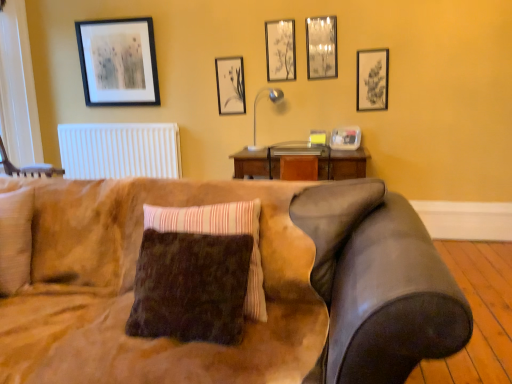
Question: From a real-world perspective, is wooden swivel chair at left located beneath brown fuzzy pillow at center?

Choices:
 (A) no
 (B) yes

Answer: (A)

Question: Is brown fuzzy pillow at center a part of wooden swivel chair at left?

Choices:
 (A) yes
 (B) no

Answer: (B)

Question: Is wooden swivel chair at left at the right side of brown fuzzy pillow at center?

Choices:
 (A) yes
 (B) no

Answer: (B)

Question: Does wooden swivel chair at left have a greater height compared to brown fuzzy pillow at center?

Choices:
 (A) yes
 (B) no

Answer: (B)

Question: Can you confirm if wooden swivel chair at left is shorter than brown fuzzy pillow at center?

Choices:
 (A) no
 (B) yes

Answer: (B)

Question: From a real-world perspective, is metallic mirror at upper center, which is the 4th picture frame from left to right, above or below matte black picture frame at upper right, arranged as the 6th picture frame when viewed from the left?

Choices:
 (A) below
 (B) above

Answer: (B)

Question: Is metallic mirror at upper center, which is the 4th picture frame from left to right, in front of or behind matte black picture frame at upper right, arranged as the 6th picture frame when viewed from the left, in the image?

Choices:
 (A) behind
 (B) front

Answer: (A)

Question: Which is correct: metallic mirror at upper center, which is the third picture frame in right-to-left order, is inside matte black picture frame at upper right, which appears as the 1th picture frame when viewed from the right, or outside of it?

Choices:
 (A) outside
 (B) inside

Answer: (A)

Question: Is metallic mirror at upper center, which is the third picture frame in right-to-left order, to the left or to the right of matte black picture frame at upper right, which appears as the 1th picture frame when viewed from the right, in the image?

Choices:
 (A) right
 (B) left

Answer: (B)

Question: Is black matte picture frame at upper left, which is counted as the 1th picture frame, starting from the left, taller or shorter than white matte radiator at upper left?

Choices:
 (A) short
 (B) tall

Answer: (B)

Question: Considering the positions of black matte picture frame at upper left, arranged as the 6th picture frame when viewed from the right, and white matte radiator at upper left in the image, is black matte picture frame at upper left, arranged as the 6th picture frame when viewed from the right, bigger or smaller than white matte radiator at upper left?

Choices:
 (A) small
 (B) big

Answer: (A)

Question: Visually, is black matte picture frame at upper left, which is counted as the 1th picture frame, starting from the left, positioned to the left or to the right of white matte radiator at upper left?

Choices:
 (A) right
 (B) left

Answer: (A)

Question: From a real-world perspective, is black matte picture frame at upper left, arranged as the 6th picture frame when viewed from the right, above or below white matte radiator at upper left?

Choices:
 (A) above
 (B) below

Answer: (A)

Question: Is black matte picture frame at upper left, arranged as the 6th picture frame when viewed from the right, wider or thinner than clear plastic container at upper right, the second picture frame from the right?

Choices:
 (A) wide
 (B) thin

Answer: (B)

Question: From the image's perspective, is black matte picture frame at upper left, arranged as the 6th picture frame when viewed from the right, located above or below clear plastic container at upper right, the second picture frame from the right?

Choices:
 (A) below
 (B) above

Answer: (B)